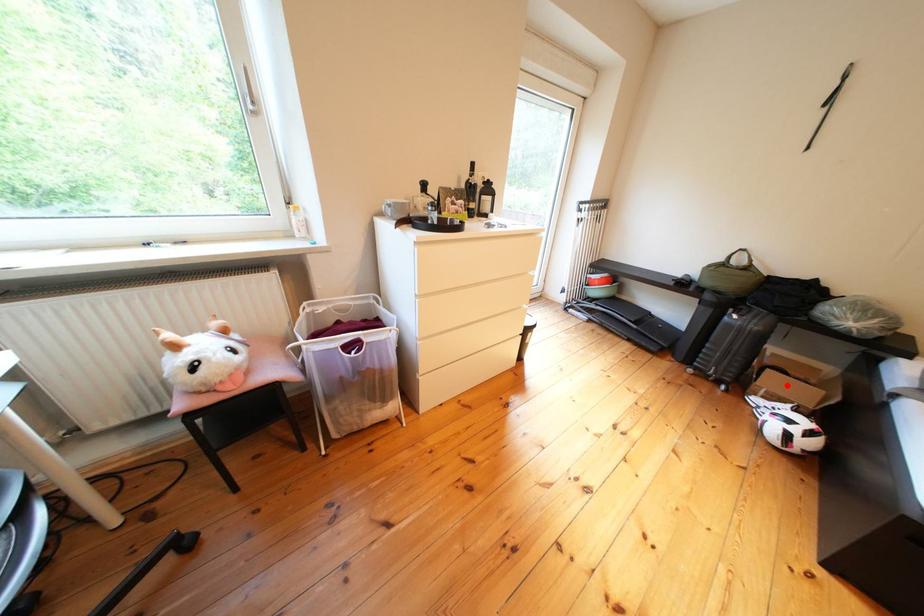
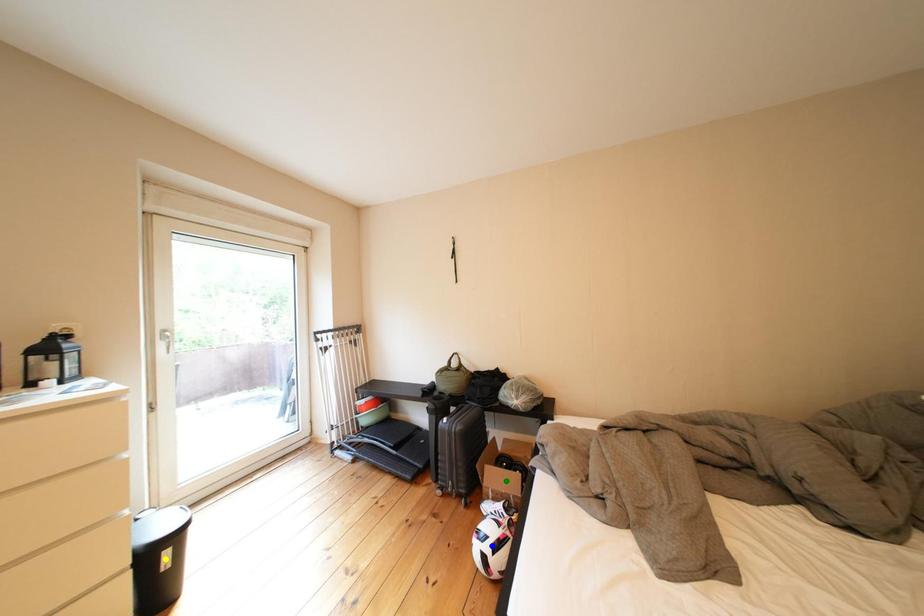
Question: I am providing you with two images of the same scene from different viewpoints. A red point is marked on the first image. You are given multiple points on the second image. Which spot in image 2 lines up with the point in image 1?

Choices:
 (A) blue point
 (B) yellow point
 (C) green point

Answer: (C)